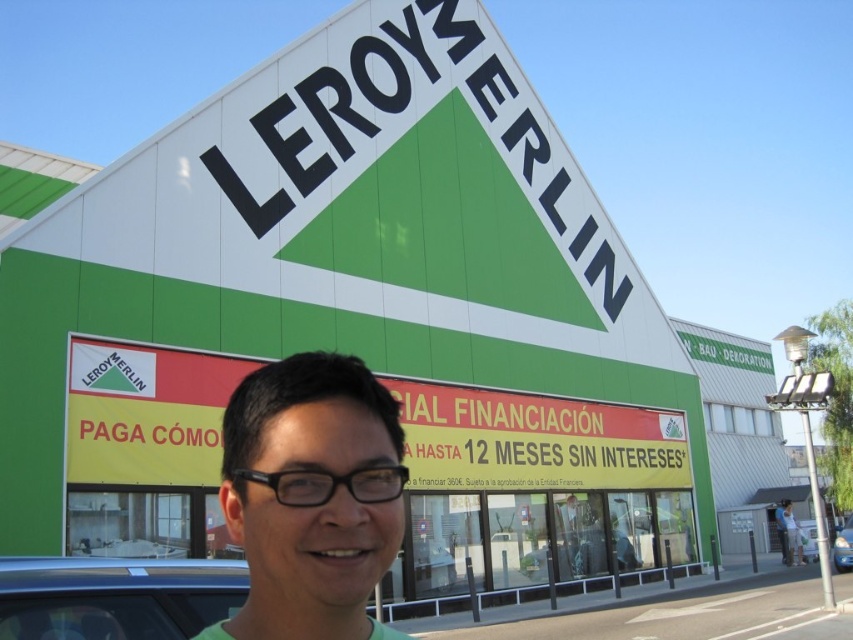
Question: From the image, what is the correct spatial relationship of green matte shirt at center in relation to matte black glasses at center?

Choices:
 (A) above
 (B) below

Answer: (A)

Question: Which object is positioned farthest from the metallic silver car at center?

Choices:
 (A) matte black glasses at center
 (B) metallic silver car at lower left

Answer: (B)

Question: Can you confirm if matte black glasses at center is positioned to the left of metallic silver car at center?

Choices:
 (A) yes
 (B) no

Answer: (A)

Question: Observing the image, what is the correct spatial positioning of green matte shirt at center in reference to metallic silver car at center?

Choices:
 (A) right
 (B) left

Answer: (B)

Question: Which point is closer to the camera?

Choices:
 (A) (781, 508)
 (B) (1, 573)

Answer: (B)

Question: Which of these objects is positioned closest to the green matte shirt at center?

Choices:
 (A) matte black glasses at center
 (B) metallic silver car at lower left

Answer: (B)